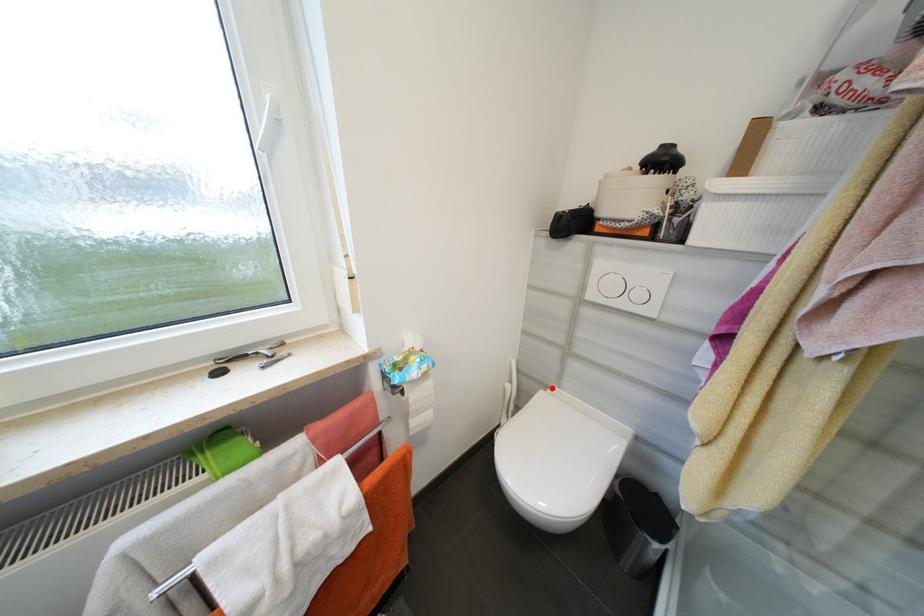
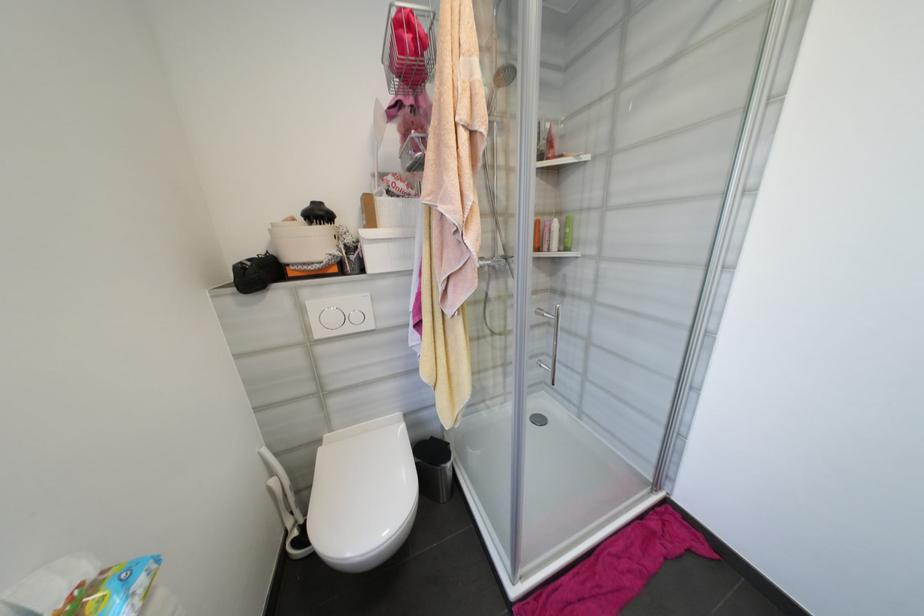
Where in the second image is the point corresponding to the highlighted location from the first image?

(325, 443)